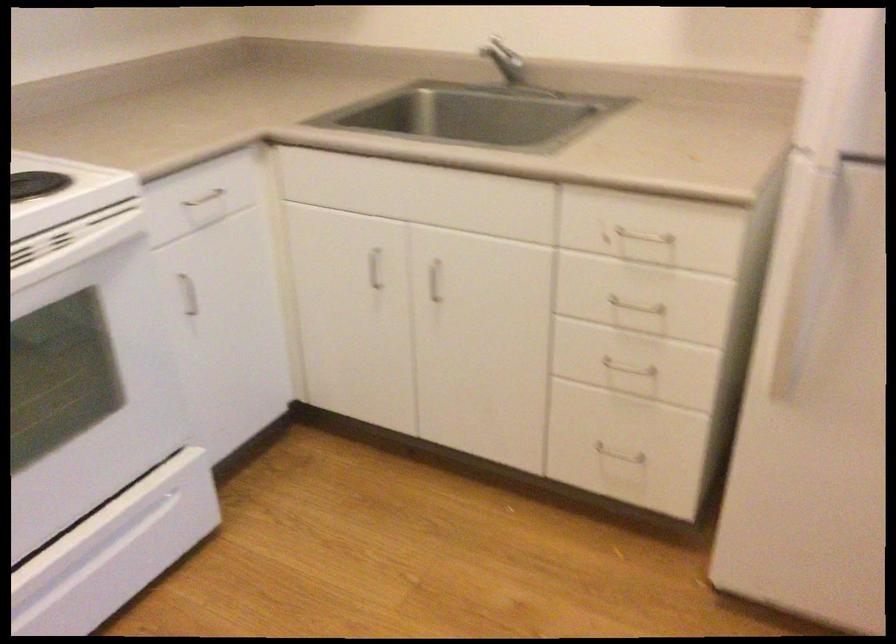
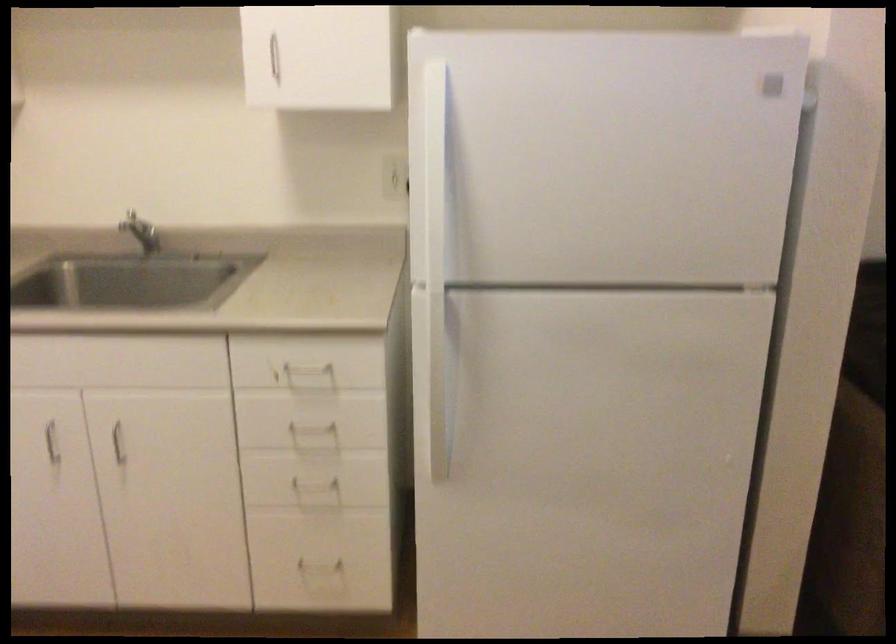
Locate, in the second image, the point that corresponds to [642,238] in the first image.

(307, 368)